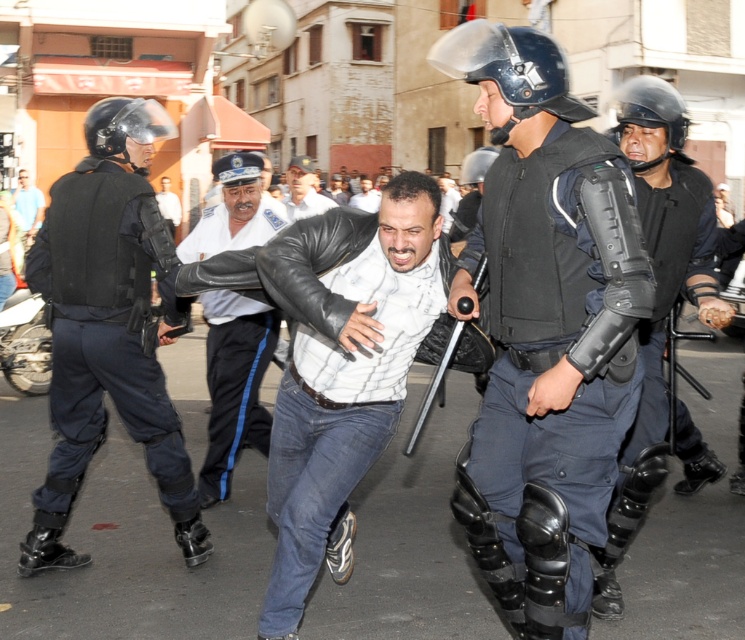
Does point (446, 68) come behind point (485, 163)?

No, (446, 68) is in front of (485, 163).

Which is behind, point (448, 42) or point (466, 164)?

The point (466, 164) is more distant.

Locate an element on the screen. black matte helmet at center is located at coordinates (510, 68).

Which is more to the left, leather jacket at center or light brown leather jacket at center?

Positioned to the left is light brown leather jacket at center.

Is point (314, 460) positioned before point (307, 209)?

Yes, point (314, 460) is in front of point (307, 209).

Locate an element on the screen. leather jacket at center is located at coordinates (342, 371).

Is black matte knee pads at lower right behind black matte helmet at upper right?

That is False.

Who is positioned more to the left, black matte knee pads at lower right or black matte helmet at upper right?

From the viewer's perspective, black matte helmet at upper right appears more on the left side.

Is point (641, 90) closer to viewer compared to point (638, 124)?

Yes, it is in front of point (638, 124).

This screenshot has width=745, height=640. Find the location of `black matte knee pads at lower right`. black matte knee pads at lower right is located at coordinates (656, 296).